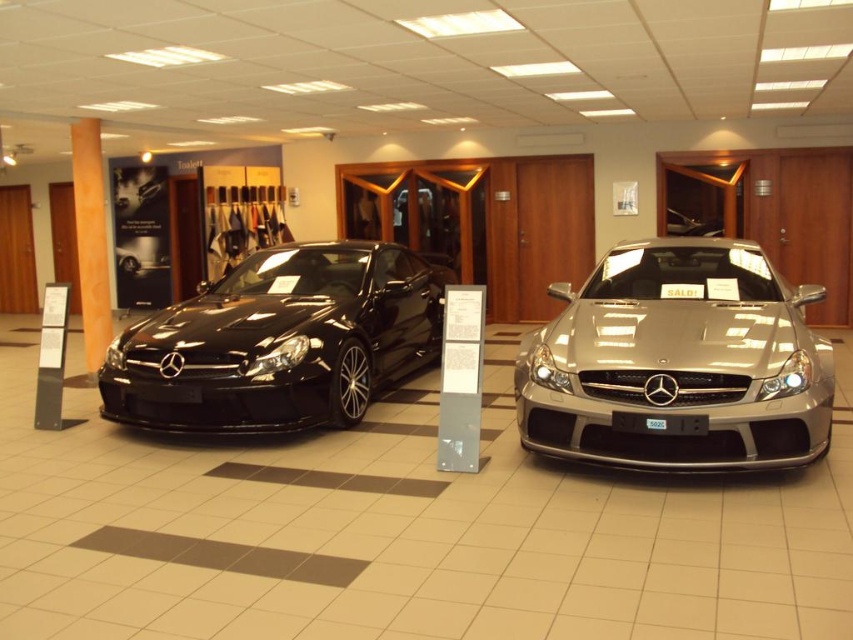
You are a photographer setting up a shoot in the showroom. You need to position a light source above the satin silver car at center so that it doesn not cast a shadow on the matte black car at left. Given their heights, will this be possible?

The satin silver car at center has a lesser height compared to matte black car at left. Since the silver car is shorter, positioning the light source above it would cast a shadow towards the black car only if the black car is behind it. However, since the black car is at the left and the silver is at the center, their relative positions might allow the light to be angled so the shadow doesn not reach the black car. But based on height alone, the shorter silver car would have a shorter shadow, making it less